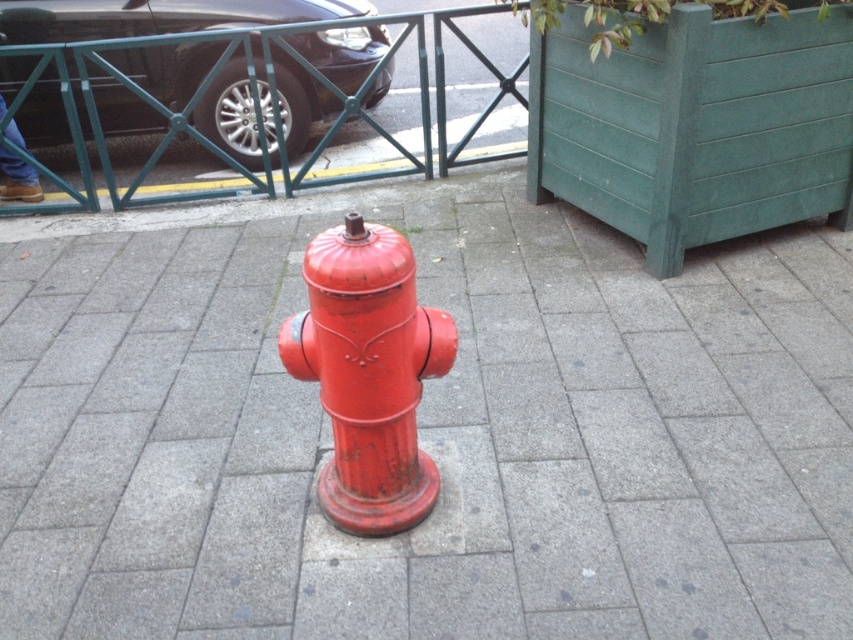
You are a delivery driver who needs to park your car next to the glossy red fire hydrant at center. The parking space is only wide enough for a vehicle narrower than the hydrant. Can your glossy black car at upper left fit in the space?

The glossy black car at upper left is wider than the glossy red fire hydrant at center. Since the parking space requires a vehicle narrower than the hydrant, the glossy black car at upper left cannot fit in the space.